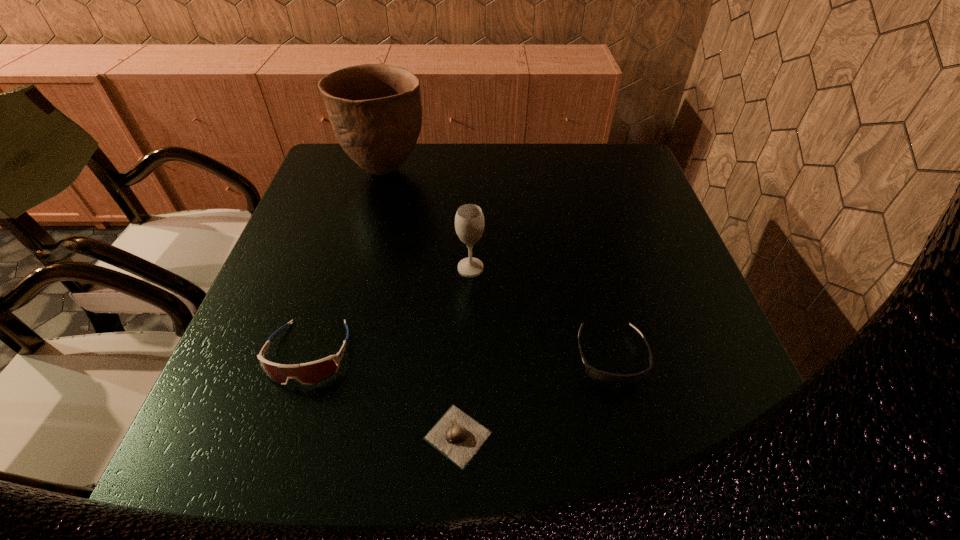
The height and width of the screenshot is (540, 960). Identify the location of the farthest object. (375, 110).

At what (x,y) coordinates should I click in order to perform the action: click on pottery. Please return your answer as a coordinate pair (x, y). The width and height of the screenshot is (960, 540). Looking at the image, I should click on (375, 110).

The width and height of the screenshot is (960, 540). Identify the location of wineglass. point(469,220).

What are the coordinates of `the fourth shortest object` in the screenshot? It's located at (469, 220).

Identify the location of the taller goggles. The image size is (960, 540). 309,373.

Find the location of a particular element. Image resolution: width=960 pixels, height=540 pixels. the third shortest object is located at coordinates (309, 373).

Where is `the right goggles`? the right goggles is located at coordinates (609, 379).

Image resolution: width=960 pixels, height=540 pixels. I want to click on the fourth tallest object, so click(x=609, y=379).

Image resolution: width=960 pixels, height=540 pixels. I want to click on the nearest object, so click(x=456, y=435).

Locate an element on the screen. the shortest object is located at coordinates (456, 435).